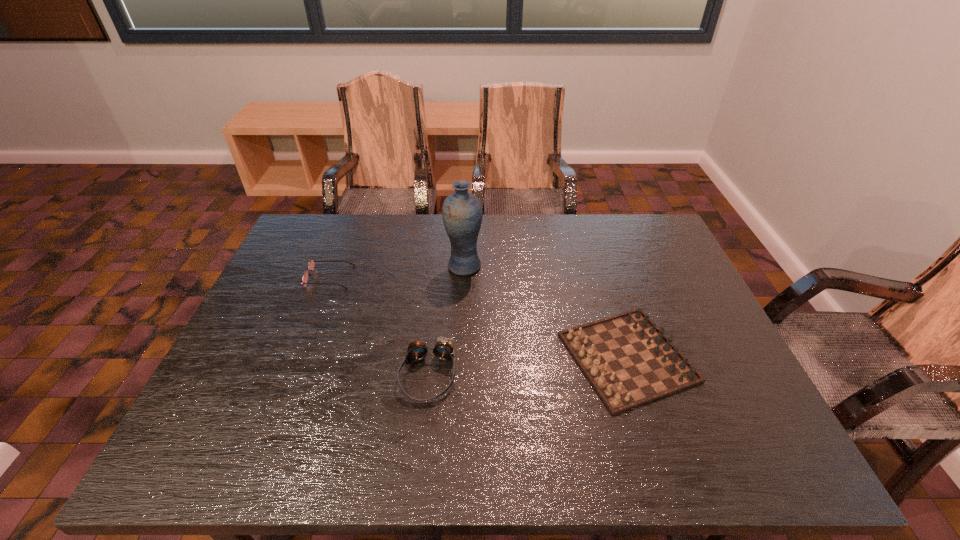
Find the location of a particular element. The height and width of the screenshot is (540, 960). vacant space that satisfies the following two spatial constraints: 1. on the bridge of the chessboard; 2. on the left side of the shortest object is located at coordinates (299, 357).

Where is `free region that satisfies the following two spatial constraints: 1. on the back side of the chessboard; 2. on the bridge of the sunglasses`? free region that satisfies the following two spatial constraints: 1. on the back side of the chessboard; 2. on the bridge of the sunglasses is located at coordinates (602, 277).